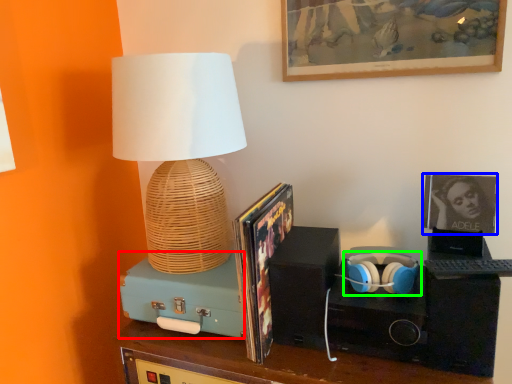
Question: Estimate the real-world distances between objects in this image. Which object is closer to speaker (highlighted by a red box), picture frame (highlighted by a blue box) or headphones (highlighted by a green box)?

Choices:
 (A) picture frame
 (B) headphones

Answer: (B)